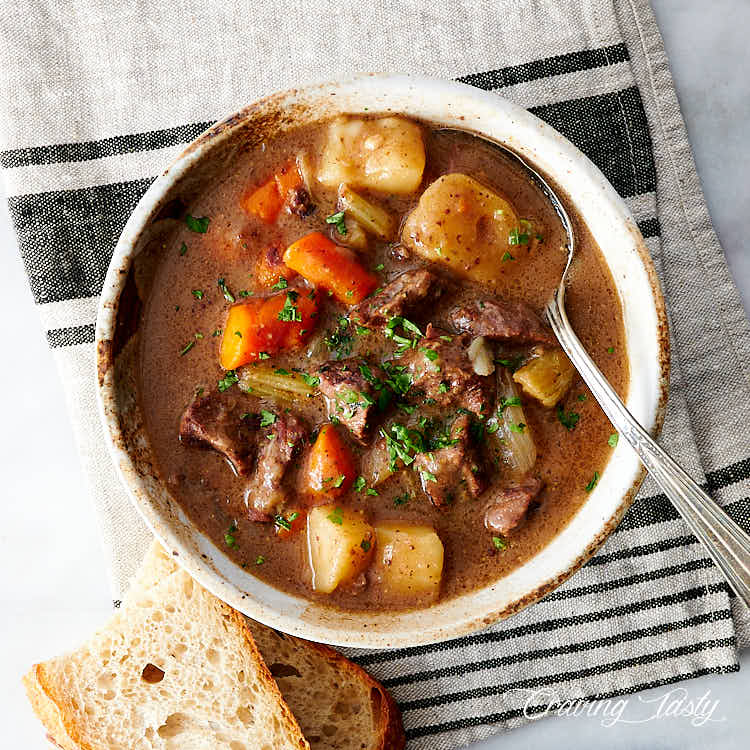
Locate an element on the screen. The height and width of the screenshot is (750, 750). spoon is located at coordinates point(588,362).